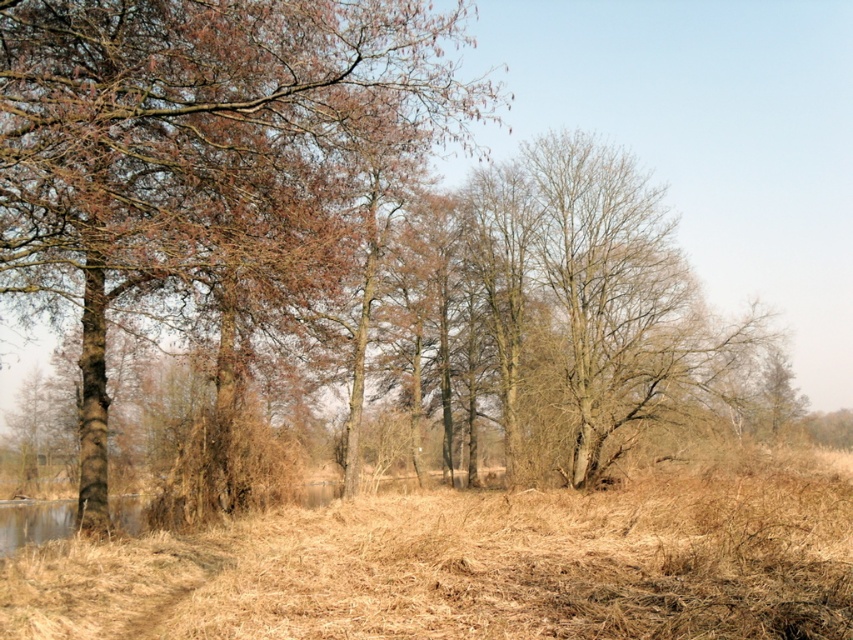
Which of these two, brown bark tree at left or brown dry grass at center, stands taller?

With more height is brown bark tree at left.

Does point (347, 173) come closer to viewer compared to point (668, 568)?

No, it is behind (668, 568).

Image resolution: width=853 pixels, height=640 pixels. In order to click on brown bark tree at left in this screenshot , I will do `click(202, 156)`.